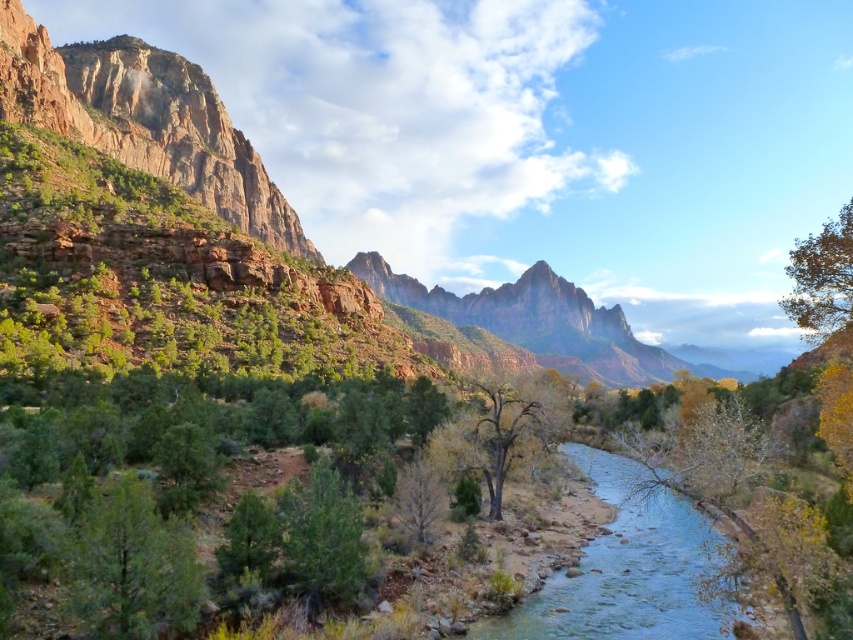
Is point (492, 433) positioned in front of point (842, 262)?

No, it is not.

Which is above, brown textured tree at center or green leafy tree at upper right?

green leafy tree at upper right is higher up.

The image size is (853, 640). What are the coordinates of `brown textured tree at center` in the screenshot? It's located at (502, 436).

The image size is (853, 640). Find the location of `brown textured tree at center`. brown textured tree at center is located at coordinates click(502, 436).

Which of these two, clear blue water at center or green leafy tree at upper right, stands shorter?

green leafy tree at upper right

Can you confirm if clear blue water at center is wider than green leafy tree at upper right?

Yes, clear blue water at center is wider than green leafy tree at upper right.

Who is more distant from viewer, (634,627) or (813,288)?

Positioned behind is point (634,627).

Identify the location of clear blue water at center. (630, 570).

Is green matte tree at lower left below brown textured tree at center?

Correct, green matte tree at lower left is located below brown textured tree at center.

Is green matte tree at lower left positioned behind brown textured tree at center?

No, green matte tree at lower left is closer to the viewer.

Consider the image. Measure the distance between point (x=132, y=636) and camera.

Point (x=132, y=636) is 31.61 meters away from camera.

The image size is (853, 640). I want to click on green matte tree at lower left, so click(132, 566).